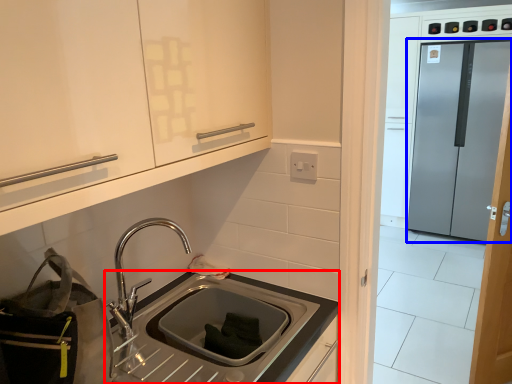
Question: Which point is closer to the camera, countertop (highlighted by a red box) or glass door (highlighted by a blue box)?

Choices:
 (A) countertop
 (B) glass door

Answer: (A)